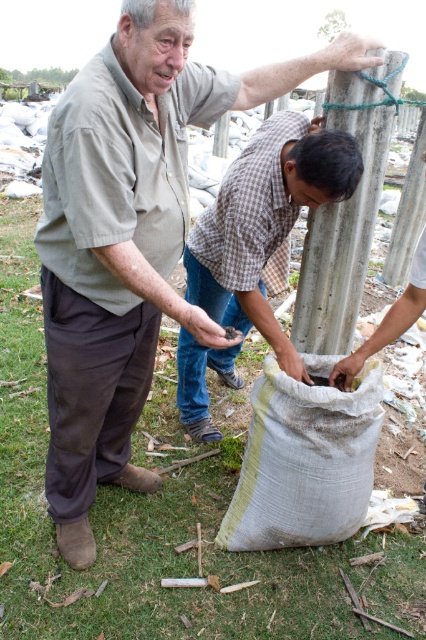
You are a photographer trying to capture a photo of the scene. You want to ensure that both the checkered fabric shirt at center and the concrete pole at center are visible in the frame. Based on their positions, which object should appear closer to the left side of the photo?

The checkered fabric shirt at center is to the left of the concrete pole at center, so it will appear closer to the left side of the photo.

You are a construction worker standing at the camera position. You need to place a 6.58 feet long wooden plank horizontally on the ground between you and the concrete pole at center. Can the plank reach the pole without any support in the middle?

The concrete pole at center is 6.58 feet from the camera. Since the wooden plank is exactly 6.58 feet long, it can be placed horizontally on the ground to reach the pole without needing support in the middle.

You are observing two workers in a grassy area with scattered debris. You notice the matte gray shirt at center and the checkered fabric shirt at center. Which worker is positioned closer to you?

The matte gray shirt at center is closer to the viewer than the checkered fabric shirt at center, so the worker wearing the matte gray shirt at center is positioned closer to you.